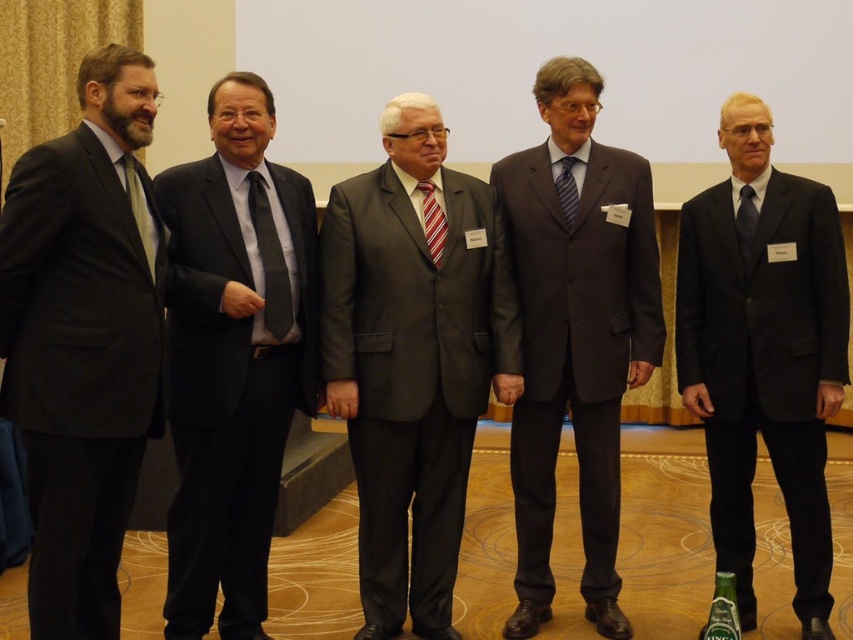
Is point (808, 289) more distant than point (570, 221)?

No, (808, 289) is closer to viewer.

Which of these two, black matte suit at right or blue striped tie at center, stands taller?

black matte suit at right is taller.

Does point (752, 595) lie behind point (561, 168)?

Yes, point (752, 595) is farther from viewer.

This screenshot has height=640, width=853. I want to click on black matte suit at right, so click(764, 355).

Does point (144, 248) lie behind point (424, 198)?

That is False.

Does matte black tie at left have a greater width compared to striped fabric tie at center?

In fact, matte black tie at left might be narrower than striped fabric tie at center.

Between point (154, 246) and point (438, 240), which one is positioned behind?

Positioned behind is point (438, 240).

Where is `matte black tie at left`? matte black tie at left is located at coordinates (138, 211).

Looking at this image, can you confirm if black matte suit at right is positioned to the right of dark blue silk tie at center?

Yes, black matte suit at right is to the right of dark blue silk tie at center.

Does black matte suit at right appear under dark blue silk tie at center?

Yes, black matte suit at right is below dark blue silk tie at center.

In order to click on black matte suit at right in this screenshot , I will do `click(764, 355)`.